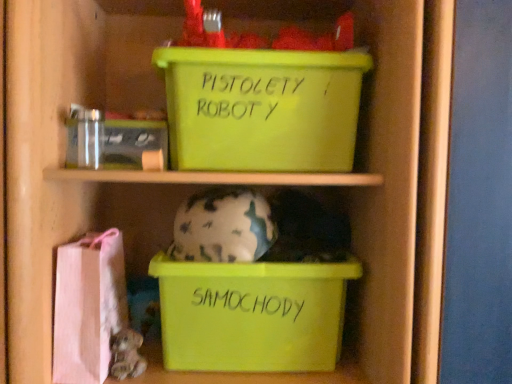
The image size is (512, 384). Describe the element at coordinates (261, 108) in the screenshot. I see `green plastic storage box at upper center, positioned as the third storage box in bottom-to-top order` at that location.

What do you see at coordinates (134, 145) in the screenshot?
I see `clear plastic jar at upper left, acting as the second storage box starting from the bottom` at bounding box center [134, 145].

What is the approximate width of pink fabric bag at lower left?

8.89 inches.

The height and width of the screenshot is (384, 512). Describe the element at coordinates (223, 227) in the screenshot. I see `camouflage-patterned ceramic piggy bank at center` at that location.

Where is `green plastic storage box at upper center, placed as the 1th storage box when sorted from top to bottom`? The image size is (512, 384). green plastic storage box at upper center, placed as the 1th storage box when sorted from top to bottom is located at coordinates (261, 108).

Can we say clear plastic jar at upper left, the second storage box viewed from the top, lies outside green plastic storage box at upper center, positioned as the third storage box in bottom-to-top order?

Yes, clear plastic jar at upper left, the second storage box viewed from the top, is located beyond the bounds of green plastic storage box at upper center, positioned as the third storage box in bottom-to-top order.

Considering the relative positions of clear plastic jar at upper left, acting as the second storage box starting from the bottom, and green plastic storage box at upper center, positioned as the third storage box in bottom-to-top order, in the image provided, is clear plastic jar at upper left, acting as the second storage box starting from the bottom, behind green plastic storage box at upper center, positioned as the third storage box in bottom-to-top order,?

Yes, it is.

Is clear plastic jar at upper left, the second storage box viewed from the top, positioned with its back to green plastic storage box at upper center, positioned as the third storage box in bottom-to-top order?

No, clear plastic jar at upper left, the second storage box viewed from the top, is not facing away from green plastic storage box at upper center, positioned as the third storage box in bottom-to-top order.

Between clear plastic jar at upper left, acting as the second storage box starting from the bottom, and green plastic storage box at upper center, placed as the 1th storage box when sorted from top to bottom, which one has larger width?

green plastic storage box at upper center, placed as the 1th storage box when sorted from top to bottom.

From the picture: From a real-world perspective, which is physically below, matte green plastic box at lower center, which is counted as the 3th storage box, starting from the top, or clear plastic jar at upper left, acting as the second storage box starting from the bottom?

matte green plastic box at lower center, which is counted as the 3th storage box, starting from the top.

Looking at this image, is matte green plastic box at lower center, the 1th storage box positioned from the bottom, to the right of clear plastic jar at upper left, acting as the second storage box starting from the bottom, from the viewer's perspective?

Yes, matte green plastic box at lower center, the 1th storage box positioned from the bottom, is to the right of clear plastic jar at upper left, acting as the second storage box starting from the bottom.

Are camouflage-patterned ceramic piggy bank at center and clear plastic jar at upper left, acting as the second storage box starting from the bottom, beside each other?

There is a gap between camouflage-patterned ceramic piggy bank at center and clear plastic jar at upper left, acting as the second storage box starting from the bottom.

Is camouflage-patterned ceramic piggy bank at center facing away from clear plastic jar at upper left, acting as the second storage box starting from the bottom?

camouflage-patterned ceramic piggy bank at center does not have its back to clear plastic jar at upper left, acting as the second storage box starting from the bottom.

Which of these two, camouflage-patterned ceramic piggy bank at center or clear plastic jar at upper left, acting as the second storage box starting from the bottom, is wider?

camouflage-patterned ceramic piggy bank at center is wider.

Does camouflage-patterned ceramic piggy bank at center have a lesser height compared to clear plastic jar at upper left, acting as the second storage box starting from the bottom?

Incorrect, the height of camouflage-patterned ceramic piggy bank at center does not fall short of that of clear plastic jar at upper left, acting as the second storage box starting from the bottom.

Who is more distant, pink fabric bag at lower left or green plastic storage box at upper center, positioned as the third storage box in bottom-to-top order?

green plastic storage box at upper center, positioned as the third storage box in bottom-to-top order, is behind.

Between point (110, 284) and point (337, 80), which one is positioned behind?

The point (110, 284) is farther from the camera.

Find the location of a particular element. This screenshot has width=512, height=384. the 2nd storage box above the pink fabric bag at lower left (from the image's perspective) is located at coordinates (261, 108).

Which of these two, pink fabric bag at lower left or green plastic storage box at upper center, placed as the 1th storage box when sorted from top to bottom, is wider?

With larger width is green plastic storage box at upper center, placed as the 1th storage box when sorted from top to bottom.

Are camouflage-patterned ceramic piggy bank at center and matte green plastic box at lower center, which is counted as the 3th storage box, starting from the top, beside each other?

camouflage-patterned ceramic piggy bank at center and matte green plastic box at lower center, which is counted as the 3th storage box, starting from the top, are clearly separated.

Does camouflage-patterned ceramic piggy bank at center lie in front of matte green plastic box at lower center, the 1th storage box positioned from the bottom?

Yes, it is.

From the image's perspective, which one is positioned higher, camouflage-patterned ceramic piggy bank at center or matte green plastic box at lower center, which is counted as the 3th storage box, starting from the top?

camouflage-patterned ceramic piggy bank at center is shown above in the image.

Does point (231, 225) come behind point (302, 308)?

No, it is in front of (302, 308).

From a real-world perspective, is matte green plastic box at lower center, the 1th storage box positioned from the bottom, beneath pink fabric bag at lower left?

Correct, in the physical world, matte green plastic box at lower center, the 1th storage box positioned from the bottom, is lower than pink fabric bag at lower left.

From the image's perspective, is matte green plastic box at lower center, the 1th storage box positioned from the bottom, located above or below pink fabric bag at lower left?

From the image's perspective, matte green plastic box at lower center, the 1th storage box positioned from the bottom, appears below pink fabric bag at lower left.

Based on the photo, considering the relative positions of matte green plastic box at lower center, the 1th storage box positioned from the bottom, and pink fabric bag at lower left in the image provided, is matte green plastic box at lower center, the 1th storage box positioned from the bottom, to the right of pink fabric bag at lower left from the viewer's perspective?

Yes, matte green plastic box at lower center, the 1th storage box positioned from the bottom, is to the right of pink fabric bag at lower left.

Is matte green plastic box at lower center, which is counted as the 3th storage box, starting from the top, inside or outside of pink fabric bag at lower left?

matte green plastic box at lower center, which is counted as the 3th storage box, starting from the top, is spatially situated outside pink fabric bag at lower left.

Locate an element on the screen. The height and width of the screenshot is (384, 512). storage box above the clear plastic jar at upper left, acting as the second storage box starting from the bottom (from a real-world perspective) is located at coordinates (261, 108).

In terms of size, does green plastic storage box at upper center, positioned as the third storage box in bottom-to-top order, appear bigger or smaller than clear plastic jar at upper left, the second storage box viewed from the top?

Considering their sizes, green plastic storage box at upper center, positioned as the third storage box in bottom-to-top order, takes up more space than clear plastic jar at upper left, the second storage box viewed from the top.

Can you tell me how much green plastic storage box at upper center, positioned as the third storage box in bottom-to-top order, and clear plastic jar at upper left, the second storage box viewed from the top, differ in facing direction?

green plastic storage box at upper center, positioned as the third storage box in bottom-to-top order, and clear plastic jar at upper left, the second storage box viewed from the top, are facing 0.000677 degrees away from each other.

Is green plastic storage box at upper center, positioned as the third storage box in bottom-to-top order, not within clear plastic jar at upper left, the second storage box viewed from the top?

Yes, green plastic storage box at upper center, positioned as the third storage box in bottom-to-top order, is outside of clear plastic jar at upper left, the second storage box viewed from the top.

You are a GUI agent. You are given a task and a screenshot of the screen. Output one action in this format:
    pyautogui.click(x=<x>, y=<y>)
    Task: Click on the 2nd storage box in front of the clear plastic jar at upper left, the second storage box viewed from the top
    This screenshot has width=512, height=384.
    Given the screenshot: What is the action you would take?
    pyautogui.click(x=261, y=108)

This screenshot has width=512, height=384. Find the location of `the 1st storage box counting from the right side of the clear plastic jar at upper left, acting as the second storage box starting from the bottom`. the 1st storage box counting from the right side of the clear plastic jar at upper left, acting as the second storage box starting from the bottom is located at coordinates (252, 314).

Estimate the real-world distances between objects in this image. Which object is further from green plastic storage box at upper center, placed as the 1th storage box when sorted from top to bottom, camouflage-patterned ceramic piggy bank at center or matte green plastic box at lower center, which is counted as the 3th storage box, starting from the top?

matte green plastic box at lower center, which is counted as the 3th storage box, starting from the top, is further to green plastic storage box at upper center, placed as the 1th storage box when sorted from top to bottom.

Considering their positions, is pink fabric bag at lower left positioned further to camouflage-patterned ceramic piggy bank at center than clear plastic jar at upper left, the second storage box viewed from the top?

pink fabric bag at lower left is positioned further to the anchor camouflage-patterned ceramic piggy bank at center.

Based on their spatial positions, is camouflage-patterned ceramic piggy bank at center or green plastic storage box at upper center, positioned as the third storage box in bottom-to-top order, further from matte green plastic box at lower center, the 1th storage box positioned from the bottom?

Among the two, green plastic storage box at upper center, positioned as the third storage box in bottom-to-top order, is located further to matte green plastic box at lower center, the 1th storage box positioned from the bottom.

Looking at the image, which one is located closer to green plastic storage box at upper center, positioned as the third storage box in bottom-to-top order, camouflage-patterned ceramic piggy bank at center or pink fabric bag at lower left?

The object closer to green plastic storage box at upper center, positioned as the third storage box in bottom-to-top order, is camouflage-patterned ceramic piggy bank at center.

Looking at the image, which one is located further to matte green plastic box at lower center, which is counted as the 3th storage box, starting from the top, pink fabric bag at lower left or camouflage-patterned ceramic piggy bank at center?

pink fabric bag at lower left is positioned further to the anchor matte green plastic box at lower center, which is counted as the 3th storage box, starting from the top.

Looking at the image, which one is located closer to clear plastic jar at upper left, acting as the second storage box starting from the bottom, pink fabric bag at lower left or green plastic storage box at upper center, placed as the 1th storage box when sorted from top to bottom?

green plastic storage box at upper center, placed as the 1th storage box when sorted from top to bottom, is positioned closer to the anchor clear plastic jar at upper left, acting as the second storage box starting from the bottom.

From the image, which object appears to be nearer to camouflage-patterned ceramic piggy bank at center, green plastic storage box at upper center, placed as the 1th storage box when sorted from top to bottom, or matte green plastic box at lower center, which is counted as the 3th storage box, starting from the top?

matte green plastic box at lower center, which is counted as the 3th storage box, starting from the top, is closer to camouflage-patterned ceramic piggy bank at center.

From the image, which object appears to be farther from pink fabric bag at lower left, camouflage-patterned ceramic piggy bank at center or matte green plastic box at lower center, which is counted as the 3th storage box, starting from the top?

The object further to pink fabric bag at lower left is matte green plastic box at lower center, which is counted as the 3th storage box, starting from the top.

Find the location of `material between green plastic storage box at upper center, positioned as the third storage box in bottom-to-top order, and matte green plastic box at lower center, which is counted as the 3th storage box, starting from the top, in the up-down direction`. material between green plastic storage box at upper center, positioned as the third storage box in bottom-to-top order, and matte green plastic box at lower center, which is counted as the 3th storage box, starting from the top, in the up-down direction is located at coordinates (88, 306).

Image resolution: width=512 pixels, height=384 pixels. Find the location of `piggy bank between clear plastic jar at upper left, acting as the second storage box starting from the bottom, and pink fabric bag at lower left vertically`. piggy bank between clear plastic jar at upper left, acting as the second storage box starting from the bottom, and pink fabric bag at lower left vertically is located at coordinates tap(223, 227).

Find the location of a particular element. This screenshot has height=384, width=512. piggy bank between green plastic storage box at upper center, positioned as the third storage box in bottom-to-top order, and matte green plastic box at lower center, the 1th storage box positioned from the bottom, in the vertical direction is located at coordinates (x=223, y=227).

Where is `material between clear plastic jar at upper left, the second storage box viewed from the top, and matte green plastic box at lower center, the 1th storage box positioned from the bottom, in the vertical direction`? The width and height of the screenshot is (512, 384). material between clear plastic jar at upper left, the second storage box viewed from the top, and matte green plastic box at lower center, the 1th storage box positioned from the bottom, in the vertical direction is located at coordinates (88, 306).